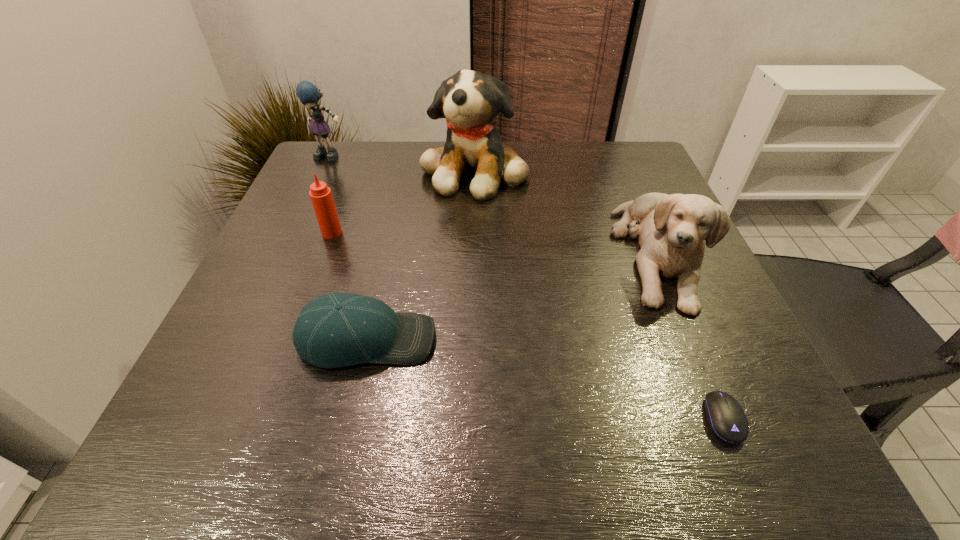
At what (x,y) coordinates should I click in order to perform the action: click on the taller puppy. Please return your answer as a coordinate pair (x, y). The image size is (960, 540). Looking at the image, I should click on (469, 100).

The height and width of the screenshot is (540, 960). I want to click on the farther puppy, so click(469, 100).

Image resolution: width=960 pixels, height=540 pixels. What are the coordinates of `rag doll` in the screenshot? It's located at (307, 92).

Find the location of a particular element. Image resolution: width=960 pixels, height=540 pixels. the right puppy is located at coordinates (672, 229).

The height and width of the screenshot is (540, 960). Find the location of `the fourth shortest object`. the fourth shortest object is located at coordinates (672, 229).

You are a GUI agent. You are given a task and a screenshot of the screen. Output one action in this format:
    pyautogui.click(x=<x>, y=<y>)
    Task: Click on the Tabasco sauce
    The height and width of the screenshot is (540, 960).
    Given the screenshot: What is the action you would take?
    pyautogui.click(x=321, y=197)

At what (x,y) coordinates should I click in order to perform the action: click on the second shortest object. Please return your answer as a coordinate pair (x, y). The height and width of the screenshot is (540, 960). Looking at the image, I should click on (336, 330).

Where is `the nearest object`? the nearest object is located at coordinates (725, 416).

At what (x,y) coordinates should I click in order to perform the action: click on computer mouse. Please return your answer as a coordinate pair (x, y). Looking at the image, I should click on (725, 416).

Locate an element on the screen. This screenshot has width=960, height=540. free space located 0.220m at the face of the tallest object is located at coordinates (x=473, y=267).